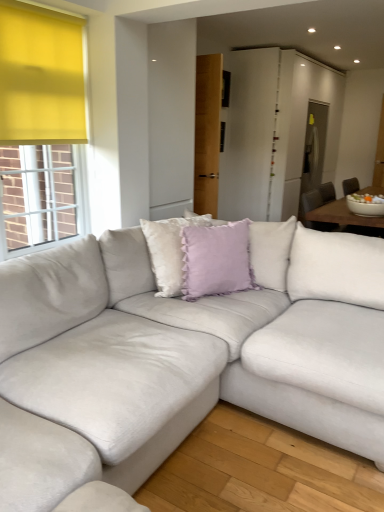
Question: In the image, is suede white couch at center positioned in front of or behind lavender velvet cushion at center, the 2th pillow from the left?

Choices:
 (A) front
 (B) behind

Answer: (A)

Question: Is suede white couch at center inside or outside of lavender velvet cushion at center, the 2th pillow from the left?

Choices:
 (A) outside
 (B) inside

Answer: (A)

Question: Based on their relative distances, which object is nearer to the lavender velvet cushion at center, acting as the first pillow starting from the right?

Choices:
 (A) suede white couch at center
 (B) lavender velvet pillow at center, the 1th pillow from the left

Answer: (B)

Question: Considering the real-world distances, which object is farthest from the lavender velvet cushion at center, the 2th pillow from the left?

Choices:
 (A) lavender velvet pillow at center, the 1th pillow from the left
 (B) suede white couch at center

Answer: (B)